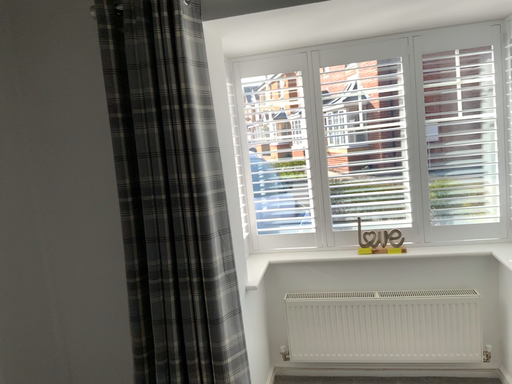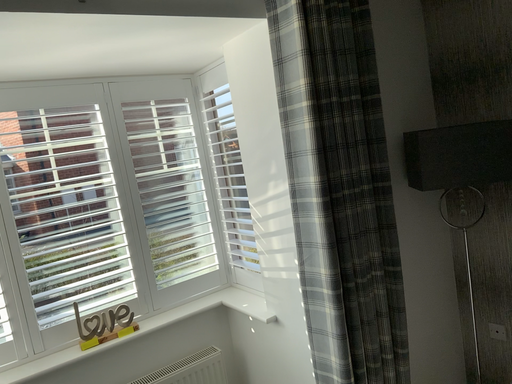
Question: Which way did the camera rotate in the video?

Choices:
 (A) rotated right
 (B) rotated left

Answer: (A)